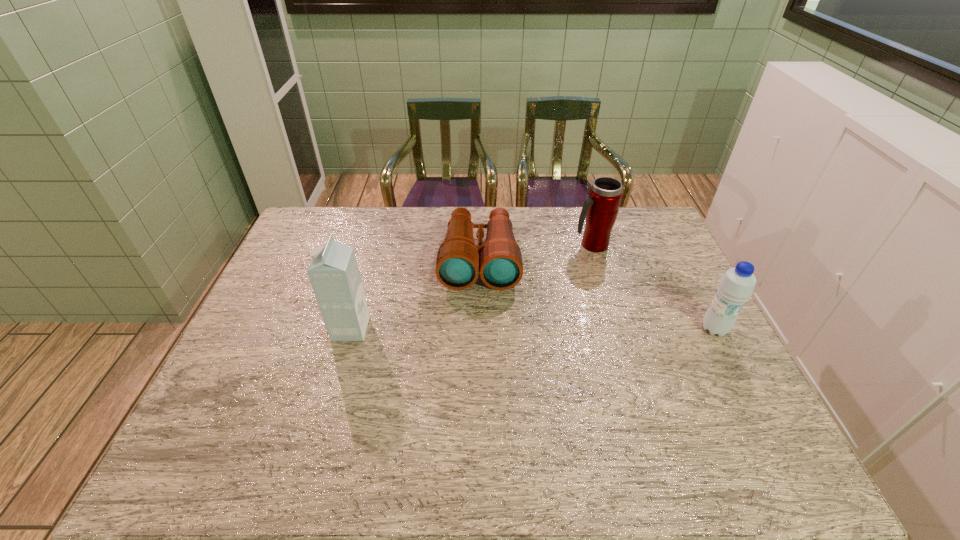
This screenshot has width=960, height=540. Identify the location of empty location between the shortest object and the leftmost object. (415, 294).

I want to click on free point between the binoculars and the thermos bottle, so click(536, 252).

This screenshot has height=540, width=960. Find the location of `object that can be found as the third closest to the rightmost object`. object that can be found as the third closest to the rightmost object is located at coordinates (333, 272).

Select which object appears as the closest to the thermos bottle. Please provide its 2D coordinates. Your answer should be formatted as a tuple, i.e. [(x, y)], where the tuple contains the x and y coordinates of a point satisfying the conditions above.

[(457, 266)]

Find the location of `free space that satisfies the following two spatial constraints: 1. on the front side of the shortest object; 2. on the right side of the water bottle`. free space that satisfies the following two spatial constraints: 1. on the front side of the shortest object; 2. on the right side of the water bottle is located at coordinates (479, 329).

Find the location of a particular element. The image size is (960, 540). blank area in the image that satisfies the following two spatial constraints: 1. on the back side of the binoculars; 2. on the right side of the second object from right to left is located at coordinates (479, 245).

Image resolution: width=960 pixels, height=540 pixels. In order to click on free point that satisfies the following two spatial constraints: 1. on the front side of the second object from left to right; 2. on the left side of the rightmost object in this screenshot , I will do pos(479,329).

The image size is (960, 540). I want to click on vacant area in the image that satisfies the following two spatial constraints: 1. on the front side of the shortest object; 2. on the right side of the water bottle, so click(479, 329).